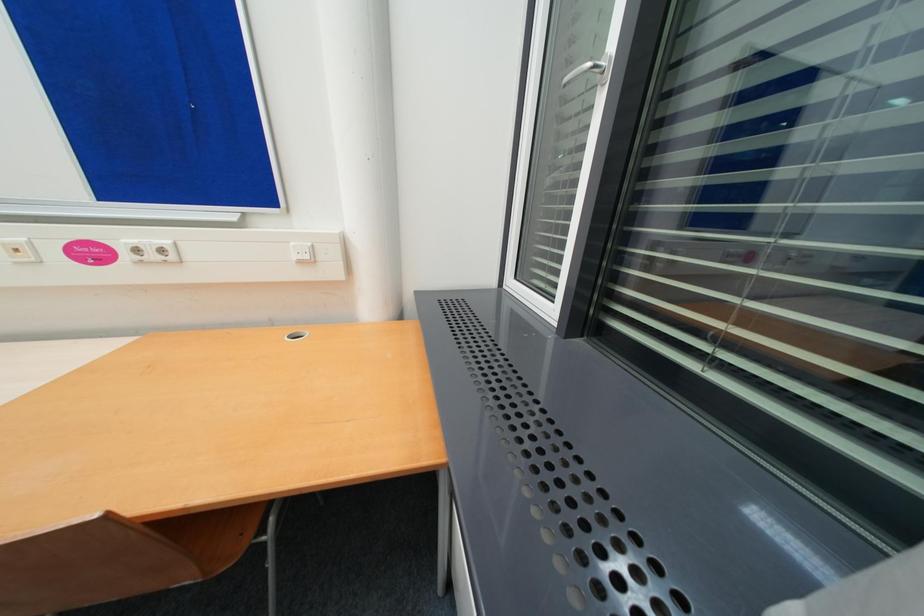
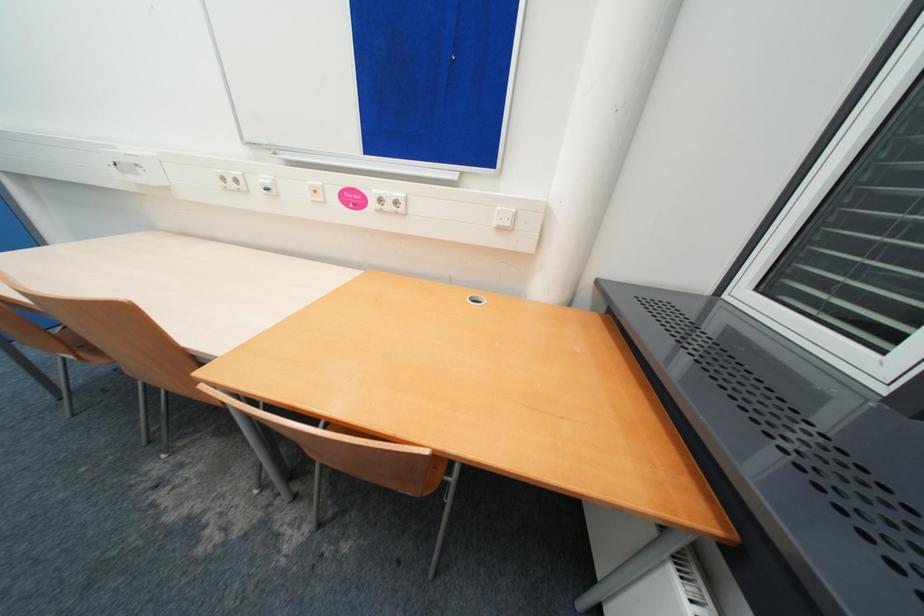
Question: The camera is either moving clockwise (left) or counter-clockwise (right) around the object. The first image is from the beginning of the video and the second image is from the end. Is the camera moving left or right when shooting the video?

Choices:
 (A) Left
 (B) Right

Answer: (B)